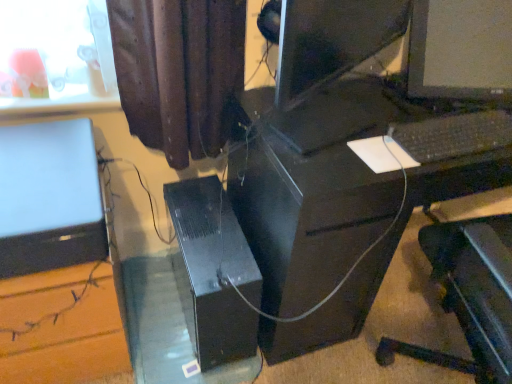
At what (x,y) coordinates should I click in order to perform the action: click on vacant space underneath black plastic keyboard at center (from a real-world perspective). Please return your answer as a coordinate pair (x, y). This screenshot has height=384, width=512. Looking at the image, I should click on (458, 131).